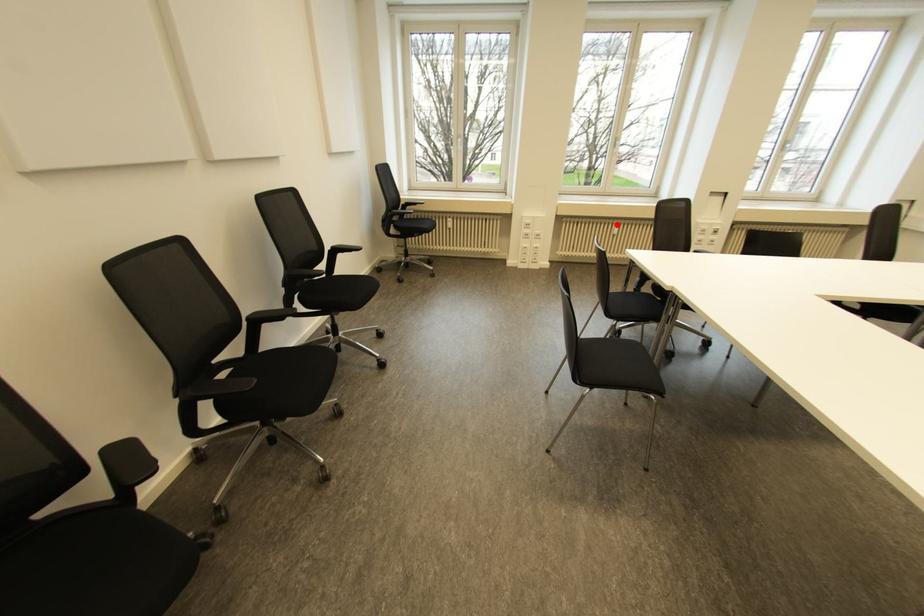
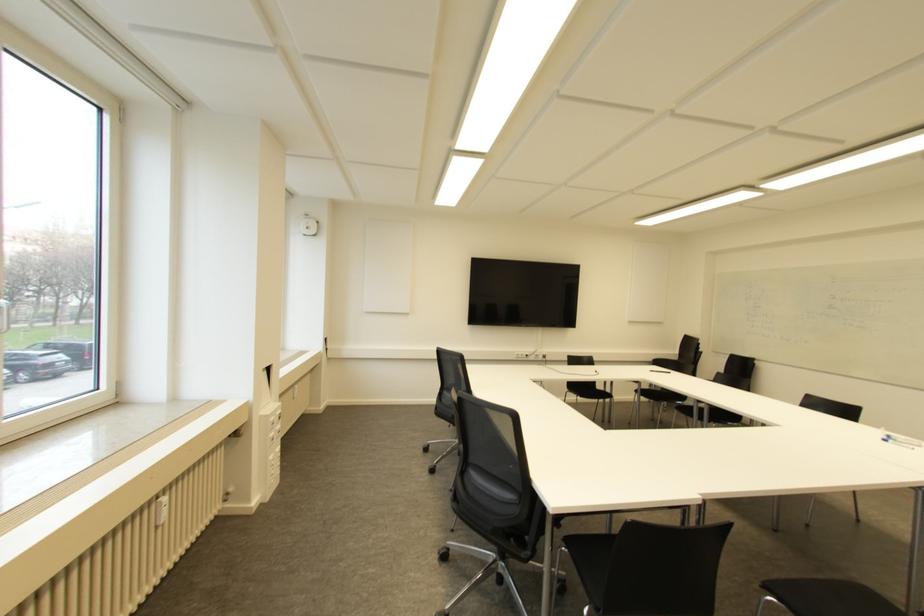
The point at the highlighted location is marked in the first image. Where is the corresponding point in the second image?

(163, 499)